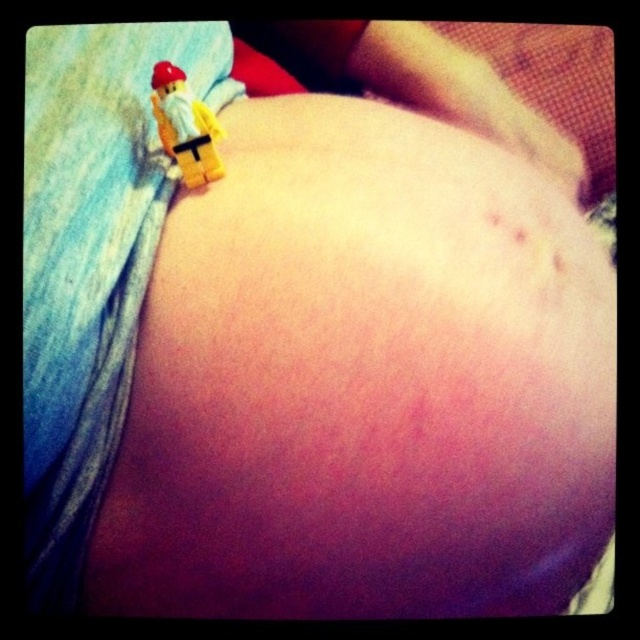
Question: Observing the image, what is the correct spatial positioning of smooth skin at upper center in reference to yellow plastic minifigure at upper left?

Choices:
 (A) left
 (B) right

Answer: (B)

Question: Does smooth skin at upper center appear over yellow plastic minifigure at upper left?

Choices:
 (A) no
 (B) yes

Answer: (B)

Question: Can you confirm if smooth skin at upper center is positioned below yellow plastic minifigure at upper left?

Choices:
 (A) no
 (B) yes

Answer: (A)

Question: Which object appears closest to the camera in this image?

Choices:
 (A) smooth skin at upper center
 (B) yellow plastic minifigure at upper left

Answer: (B)

Question: Among these objects, which one is farthest from the camera?

Choices:
 (A) smooth skin at upper center
 (B) yellow plastic minifigure at upper left

Answer: (A)